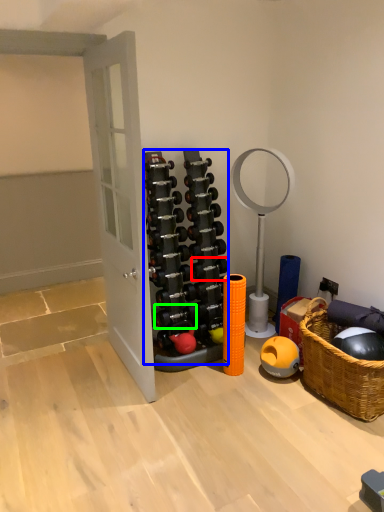
Question: Considering the real-world distances, which object is farthest from dumbbell (highlighted by a red box)? dumbbell (highlighted by a blue box) or dumbbell (highlighted by a green box)?

Choices:
 (A) dumbbell
 (B) dumbbell

Answer: (B)